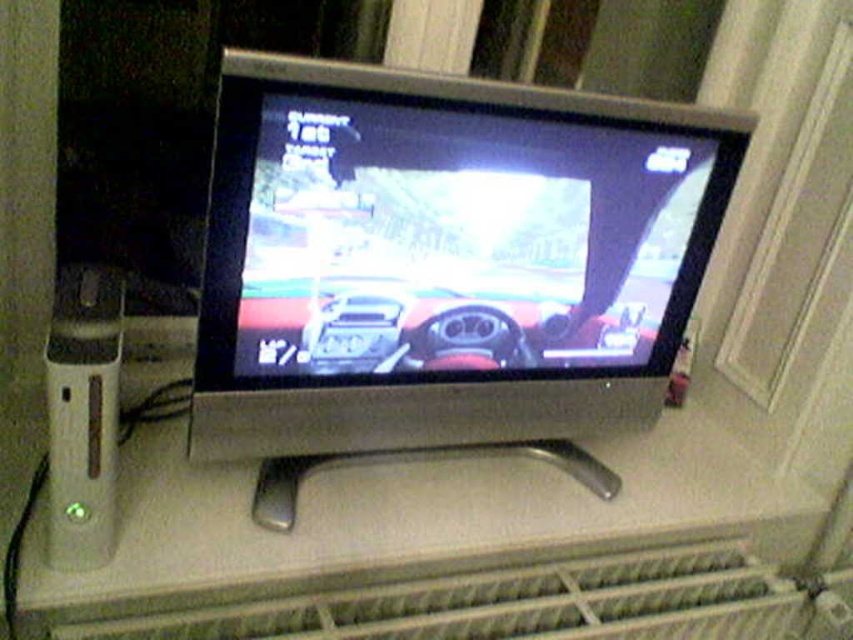
You are setting up a new TV stand and need to know the spatial relationship between the shiny black monitor at center and the gray metallic radiator at lower center. Which object is closer to you?

The shiny black monitor at center is closer to you since it is further to the viewer than the gray metallic radiator at lower center, meaning it occupies a more forward position in the scene.

You are standing in front of the CRT television and want to reach both points mentioned. Which point, point (532,332) or point (463,605), is closer to you?

Result: Point (532,332) is closer to you because it is further to the viewer than point (463,605).

You are setting up a new TV stand and need to know the vertical position of the shiny black monitor at center relative to the gray metallic radiator at lower center. Is the monitor placed above or below the radiator?

The shiny black monitor at center is above the gray metallic radiator at lower center.